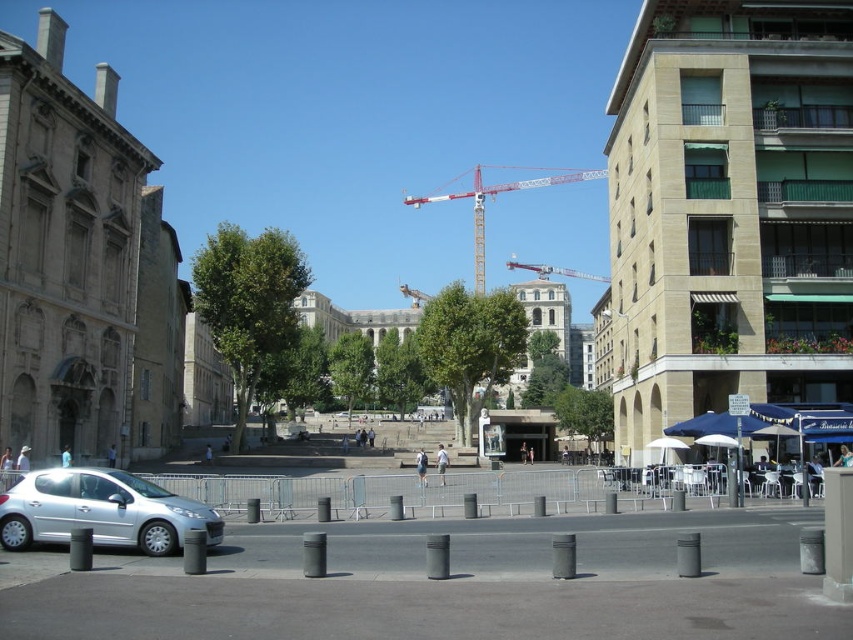
You are a pedestrian standing at the edge of the plaza and want to reach the entrance of the historic building. The entrance is located at the base of the columns on the left side of the building. There is a silver metallic car at lower left and a metallic red crane at center. Which object is closer to your current position?

The silver metallic car at lower left is closer to your current position because it is located below the metallic red crane at center, meaning it is nearer to the plaza edge where you are standing.

Consider the image. You are a city planner assessing the space between the two cranes in the urban scene. Given that the minimum required distance for safety regulations is 20 meters, can the white metal crane at center and the metallic red crane at center be operated safely without violating the regulations?

The distance between the white metal crane at center and the metallic red crane at center is 21.73 meters, which exceeds the 20 meters safety requirement. Therefore, they can be operated safely without violating regulations.

You are a delivery driver who needs to park your silver metallic car at lower left in a designated parking spot located at point 0.800, 0.120. Is your current position already at the parking spot?

Yes, the silver metallic car at lower left is already positioned at point (102, 512), so it is correctly parked in the designated parking spot.